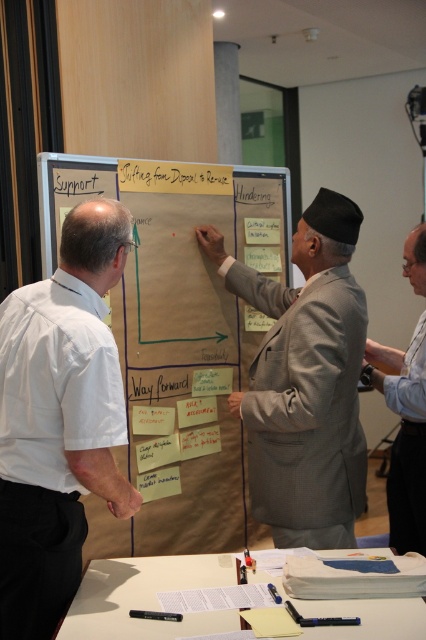
Question: Among these points, which one is farthest from the camera?

Choices:
 (A) (146, 236)
 (B) (172, 625)
 (C) (420, 353)

Answer: (A)

Question: Which point is farther to the camera?

Choices:
 (A) (160, 298)
 (B) (181, 385)
 (C) (43, 525)

Answer: (B)

Question: Is beige paperboard at center above light gray suit at center?

Choices:
 (A) yes
 (B) no

Answer: (A)

Question: Can you confirm if white paper at lower center is thinner than white paper at center?

Choices:
 (A) no
 (B) yes

Answer: (A)

Question: Which point is closer to the camera?

Choices:
 (A) light gray suit at center
 (B) white paper at center
 (C) beige paperboard at center
 (D) white shirt at left

Answer: (D)

Question: Is white shirt at left positioned behind light gray suit at center?

Choices:
 (A) yes
 (B) no

Answer: (B)